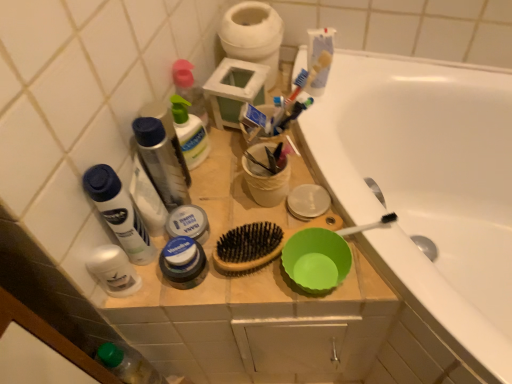
The width and height of the screenshot is (512, 384). I want to click on vacant space positioned to the left of metallic silver bowl at upper right, the second basin positioned from the top, so click(234, 213).